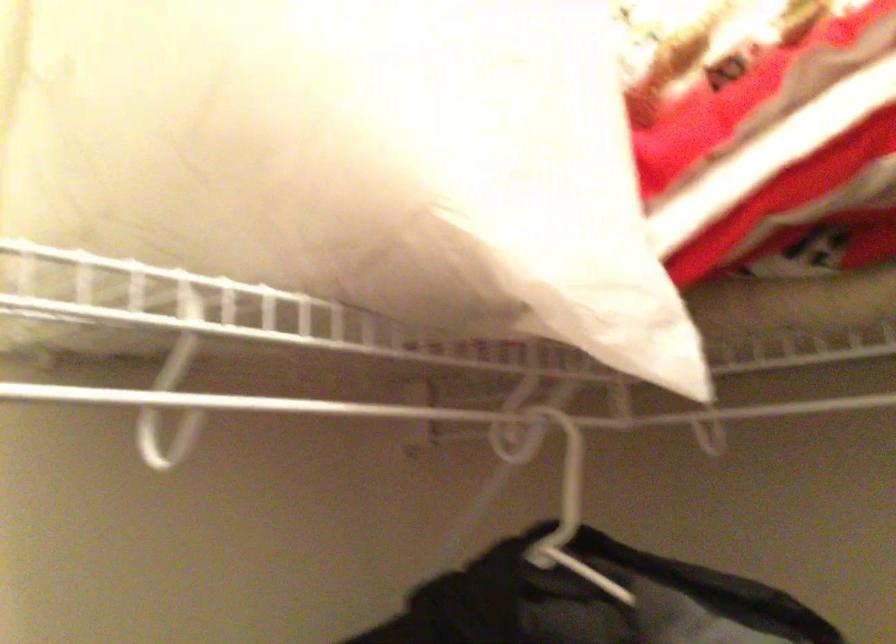
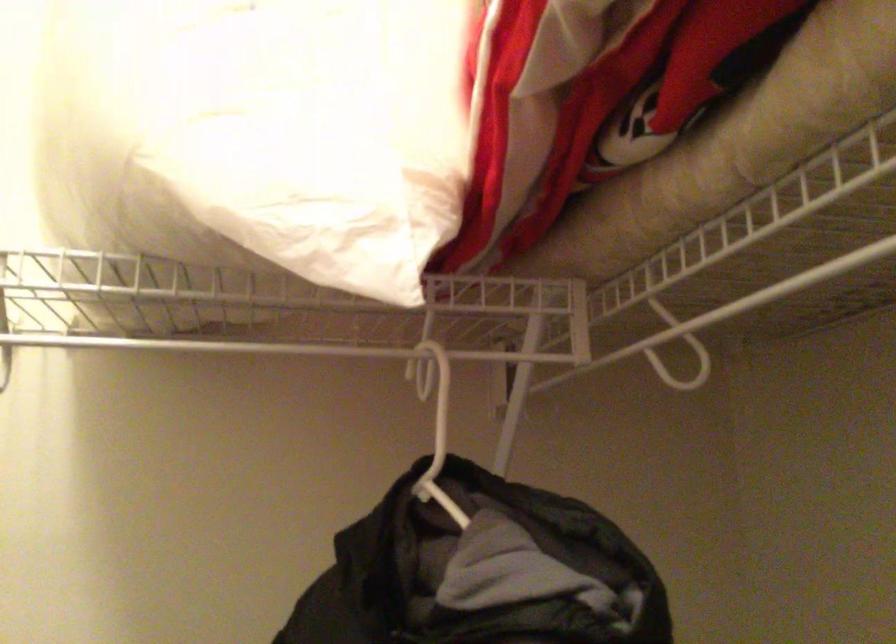
The point at (351, 444) is marked in the first image. Where is the corresponding point in the second image?

(436, 404)